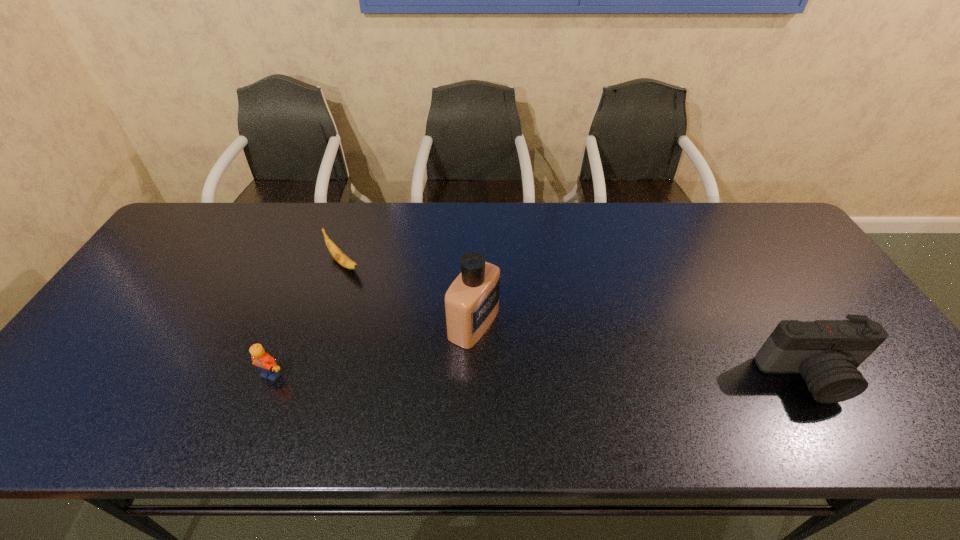
Locate an element on the screen. vacant region located on the front label of the third object from left to right is located at coordinates (606, 388).

At what (x,y) coordinates should I click in order to perform the action: click on vacant space situated on the front label of the third object from left to right. Please return your answer as a coordinate pair (x, y). Looking at the image, I should click on coord(569,371).

At what (x,y) coordinates should I click in order to perform the action: click on free space located 0.130m on the front label of the third object from left to right. Please return your answer as a coordinate pair (x, y). Looking at the image, I should click on (542, 359).

This screenshot has height=540, width=960. Find the location of `Lego that is positioned at the near edge`. Lego that is positioned at the near edge is located at coordinates (270, 370).

Locate an element on the screen. This screenshot has height=540, width=960. camera located in the near edge section of the desktop is located at coordinates (827, 353).

This screenshot has width=960, height=540. I want to click on object at the right edge, so click(x=827, y=353).

Where is `object that is at the near right corner`? This screenshot has width=960, height=540. object that is at the near right corner is located at coordinates (827, 353).

Locate an element on the screen. vacant space at the far edge of the desktop is located at coordinates (720, 228).

In the image, there is a desktop. Find the location of `vacant area at the near edge`. vacant area at the near edge is located at coordinates (287, 399).

The height and width of the screenshot is (540, 960). In the image, there is a desktop. Identify the location of vacant space at the left edge. (77, 361).